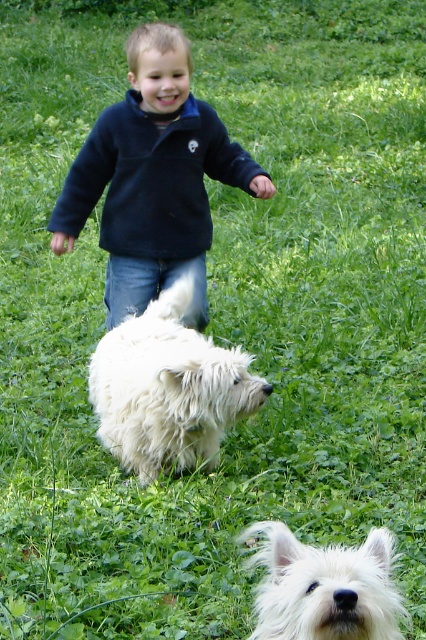
Question: Which point is closer to the camera taking this photo?

Choices:
 (A) (112, 218)
 (B) (308, 637)
 (C) (169, 378)

Answer: (B)

Question: Based on their relative distances, which object is farther from the white fluffy dog at center?

Choices:
 (A) dark blue fleece jacket at center
 (B) white fluffy dog at lower center

Answer: (B)

Question: Can you confirm if dark blue fleece jacket at center is positioned to the left of white fluffy dog at lower center?

Choices:
 (A) no
 (B) yes

Answer: (B)

Question: Is white fluffy dog at center smaller than white fluffy dog at lower center?

Choices:
 (A) yes
 (B) no

Answer: (B)

Question: Which point is closer to the camera taking this photo?

Choices:
 (A) (255, 529)
 (B) (189, 333)

Answer: (A)

Question: Does dark blue fleece jacket at center have a lesser width compared to white fluffy dog at lower center?

Choices:
 (A) no
 (B) yes

Answer: (A)